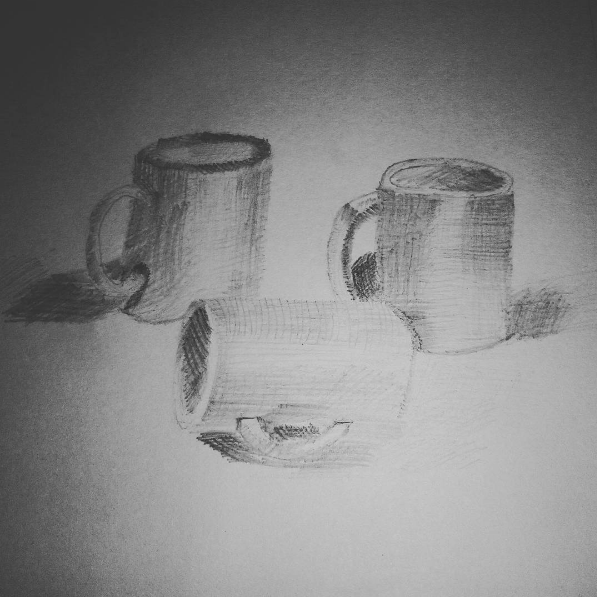
Identify the location of tipped over cups. The height and width of the screenshot is (597, 597). (309, 366).